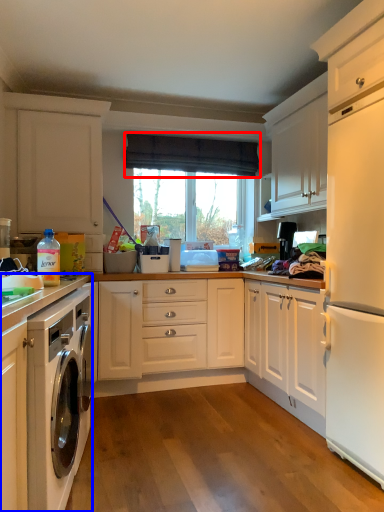
Question: Among these objects, which one is nearest to the camera, curtain (highlighted by a red box) or cabinetry (highlighted by a blue box)?

Choices:
 (A) curtain
 (B) cabinetry

Answer: (B)